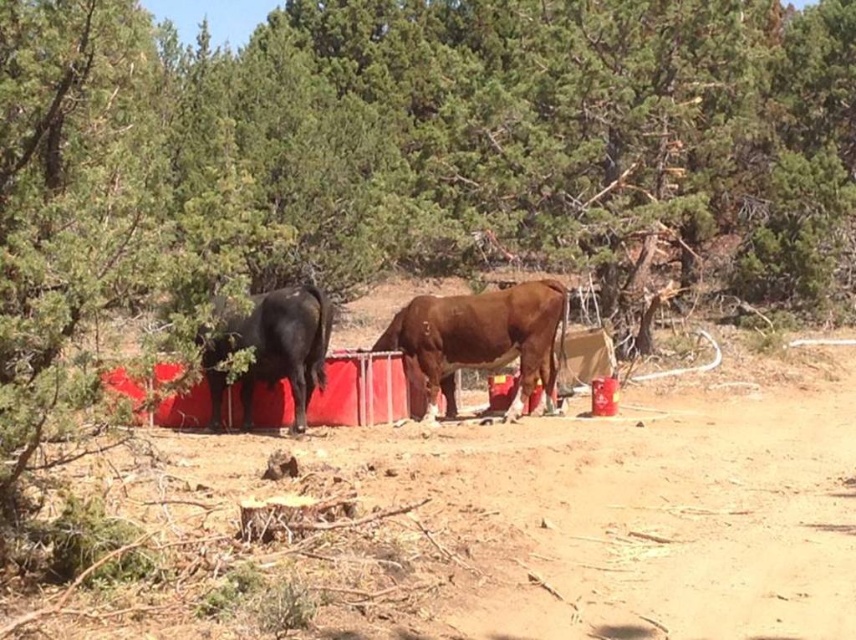
You are a farmer checking on your livestock. You notice the brown matte cow at center and the shiny black bull at left. Which animal is closer to you as you stand in front of the feeding trough?

The brown matte cow at center is closer to you because the shiny black bull at left is positioned behind it.

You are a farmer who wants to separate the brown matte cow at center and the shiny black bull at left into two different pens based on their sizes. Which pen should the smaller animal be placed in?

The brown matte cow at center has a smaller size compared to the shiny black bull at left, so the smaller animal should be placed in the pen designated for smaller animals.

You are a photographer standing in the foreground of a rural scene with two cows near a red feeding trough. You want to capture a closeup of the dirt field at center. Given that your camera can focus on objects within 5 meters, will you be able to take the photo without moving closer?

The dirt field at center is 4.32 meters away from the camera, which is within the 5 meter focusing range. Therefore, you can take the closeup without moving closer.